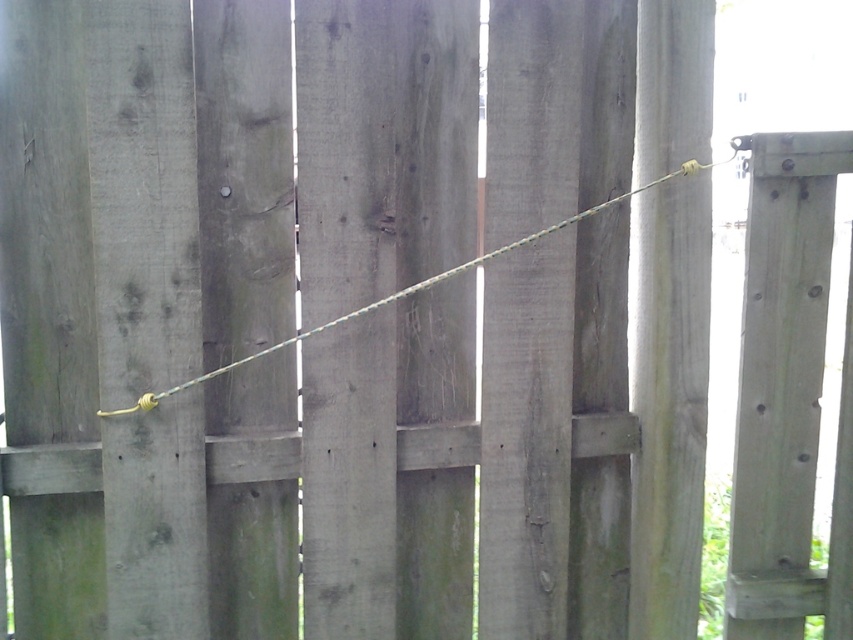
Looking at this image, you are standing in front of the wooden fence and need to locate the gray wood pole at right. Where exactly is it positioned on the fence?

The gray wood pole at right is positioned at the 2D coordinate point of 0.634 on the x axis and 0.785 on the y axis.

You are standing in front of the wooden fence and notice the gray wood pole at right and the green rope at center. Which object is positioned lower in relation to the other?

The gray wood pole at right is located below the green rope at center, so it is positioned lower than the green rope at center.

You are standing in front of the wooden fence and see the gray wood pole at right and the green rope at center. Which object is closer to you?

The gray wood pole at right is closer to you because it is further to the viewer than the green rope at center.